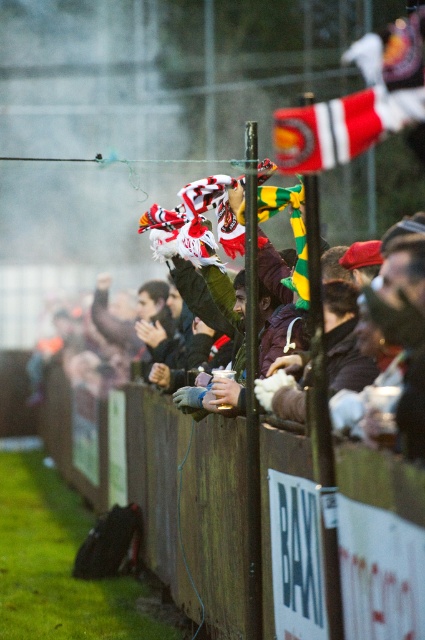
Question: Which point is closer to the camera?

Choices:
 (A) (48, 451)
 (B) (207, 323)

Answer: (B)

Question: Among these points, which one is farthest from the camera?

Choices:
 (A) (265, 522)
 (B) (351, 125)
 (C) (410, 422)

Answer: (A)

Question: Based on their relative distances, which object is farther from the wooden fence at center?

Choices:
 (A) red and white striped flag at upper right
 (B) white and red scarf at center

Answer: (A)

Question: Does white and red scarf at center have a smaller size compared to red and white striped flag at upper right?

Choices:
 (A) no
 (B) yes

Answer: (B)

Question: Does wooden fence at center have a lesser width compared to white and red scarf at center?

Choices:
 (A) no
 (B) yes

Answer: (A)

Question: Is wooden fence at center behind white and red scarf at center?

Choices:
 (A) no
 (B) yes

Answer: (A)